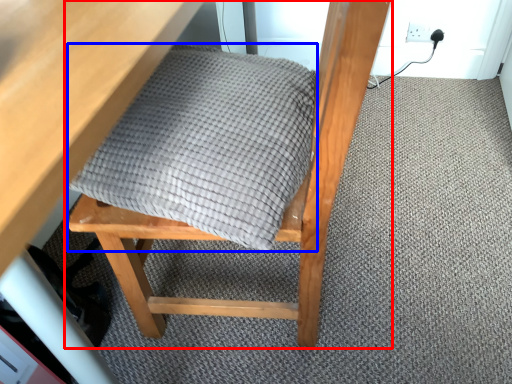
Question: Which of the following is the farthest to the observer, chair (highlighted by a red box) or blanket (highlighted by a blue box)?

Choices:
 (A) chair
 (B) blanket

Answer: (B)